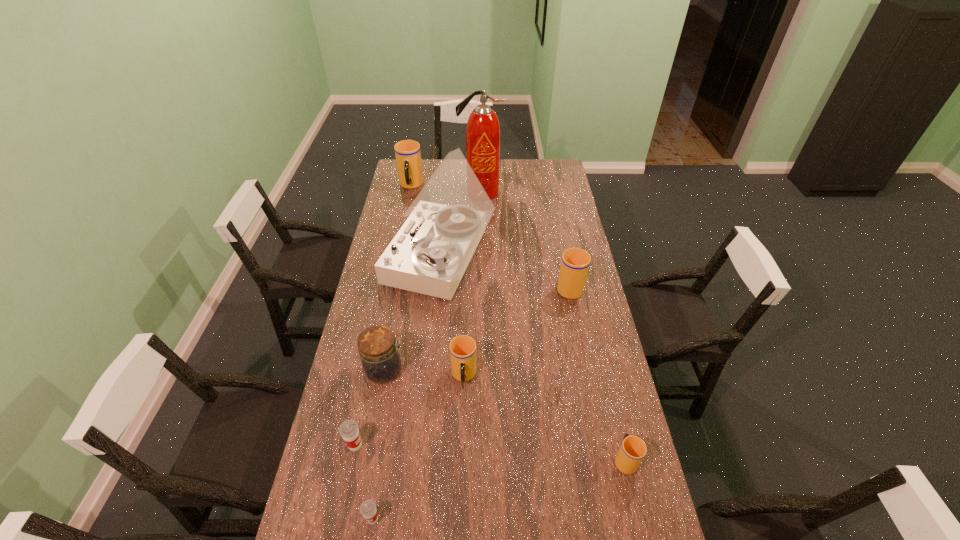
Find the location of a particular element. This screenshot has width=960, height=540. jar that is at the left edge is located at coordinates (380, 358).

Image resolution: width=960 pixels, height=540 pixels. In order to click on object located at the far left corner in this screenshot , I will do `click(407, 152)`.

Identify the location of free space at the left edge of the desktop. The image size is (960, 540). (383, 321).

This screenshot has height=540, width=960. What are the coordinates of `free location at the right edge of the desktop` in the screenshot? It's located at (584, 363).

This screenshot has width=960, height=540. What are the coordinates of `vacant space at the far right corner` in the screenshot? It's located at (550, 177).

The height and width of the screenshot is (540, 960). Find the location of `free space between the smaller red cup and the red fire extinguisher`. free space between the smaller red cup and the red fire extinguisher is located at coordinates (426, 355).

Find the location of a particular element. This screenshot has width=960, height=540. vacant space that's between the red fire extinguisher and the nearest beige cup is located at coordinates (553, 326).

You are a GUI agent. You are given a task and a screenshot of the screen. Output one action in this format:
    pyautogui.click(x=<x>, y=<y>)
    Task: Click on the vacant area that lies between the second nearest beige cup and the nearest cup
    The width and height of the screenshot is (960, 540).
    Given the screenshot: What is the action you would take?
    pyautogui.click(x=419, y=448)

Where is `vacant area that lies between the smallest beige cup and the second tallest cup`? vacant area that lies between the smallest beige cup and the second tallest cup is located at coordinates (597, 373).

At what (x,y) coordinates should I click in order to perform the action: click on vacant area that lies between the fifth nearest cup and the fire extinguisher. Please return your answer as a coordinate pair (x, y). Image resolution: width=960 pixels, height=540 pixels. Looking at the image, I should click on (525, 239).